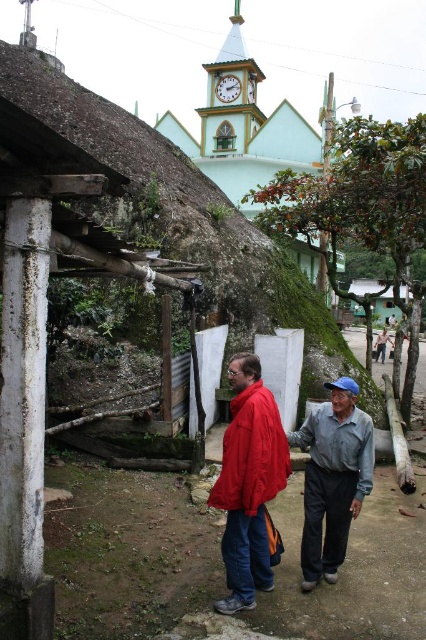
Between green leafy tree at center and white wooden clock at upper center, which one is positioned higher?

Positioned higher is white wooden clock at upper center.

Where is `green leafy tree at center`? green leafy tree at center is located at coordinates point(363,216).

Between point (356, 236) and point (221, 77), which one is positioned in front?

Point (356, 236) is more forward.

I want to click on green leafy tree at center, so click(x=363, y=216).

Who is more distant from viewer, (244,433) or (322,422)?

Positioned behind is point (322,422).

Is matte red jacket at center further to camera compared to gray cotton shirt at lower right?

No, matte red jacket at center is in front of gray cotton shirt at lower right.

Between point (247, 401) and point (305, 556), which one is positioned in front?

Point (305, 556)

Where is `matte red jacket at center`? The height and width of the screenshot is (640, 426). matte red jacket at center is located at coordinates (249, 483).

Can you confirm if green leafy tree at center is positioned to the left of gray cotton shirt at lower right?

No, green leafy tree at center is not to the left of gray cotton shirt at lower right.

At what (x,y) coordinates should I click in order to perform the action: click on green leafy tree at center. Please return your answer as a coordinate pair (x, y). Looking at the image, I should click on (363, 216).

This screenshot has height=640, width=426. I want to click on green leafy tree at center, so click(363, 216).

Find the location of a particular element. green leafy tree at center is located at coordinates (363, 216).